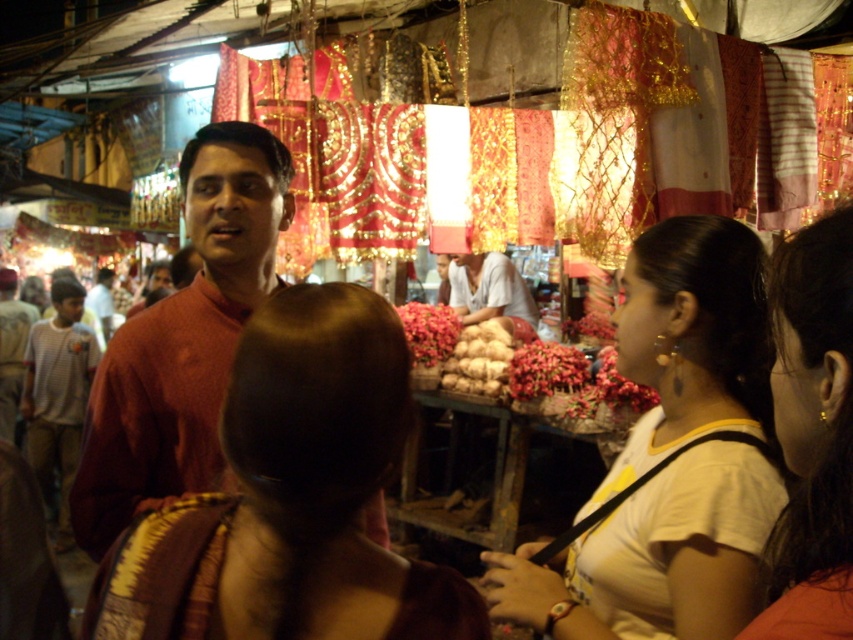
In the scene shown: Is matte red shirt at center smaller than matte brown shirt at center?

No.

Which is in front, point (125, 428) or point (438, 259)?

Point (125, 428)

The width and height of the screenshot is (853, 640). I want to click on matte red shirt at center, so click(183, 339).

Who is taller, white matte shirt at center or white cotton shirt at center?

→ white matte shirt at center

Is white matte shirt at center positioned before white cotton shirt at center?

Yes.

Is point (727, 637) less distant than point (461, 321)?

Yes, it is in front of point (461, 321).

Where is `white matte shirt at center`? white matte shirt at center is located at coordinates (654, 556).

Does point (675, 317) lie in front of point (51, 337)?

Yes, point (675, 317) is closer to viewer.

Between white matte shirt at center and light brown cotton shirt at left, which one has less height?

white matte shirt at center

Between point (682, 433) and point (28, 392), which one is positioned in front?

Point (682, 433) is more forward.

Locate an element on the screen. The width and height of the screenshot is (853, 640). white matte shirt at center is located at coordinates (654, 556).